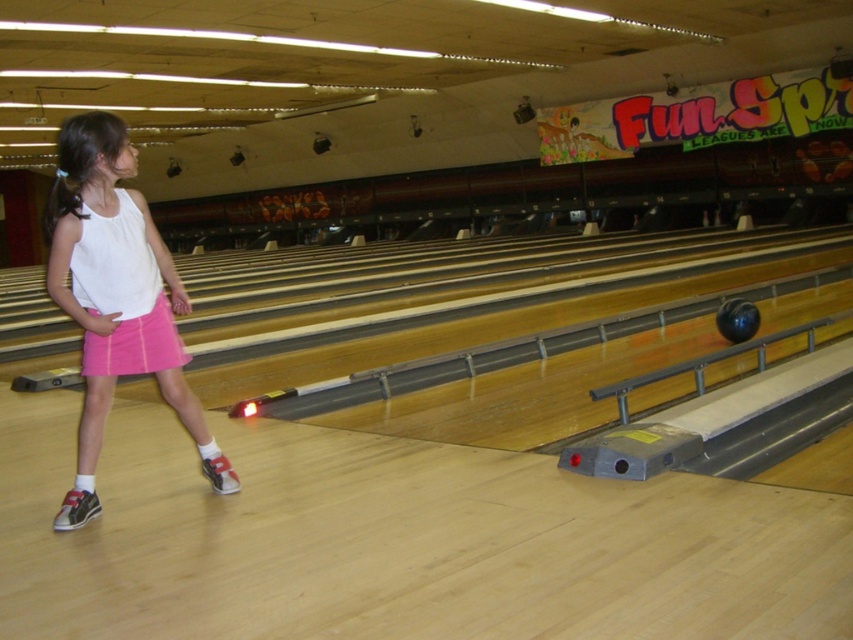
You are standing at the entrance of the bowling alley and see two points marked on the lane. Which point, point (x=85, y=129) or point (x=137, y=348), is closer to you?

Point (x=85, y=129) is closer to the viewer than point (x=137, y=348).

You are standing at the entrance of the bowling alley and see a point marked at coordinates (78, 282). If you want to throw a ball that travels exactly 3.22 meters, can you reach that point with your throw?

Yes, because the point at coordinates (78, 282) is exactly 3.22 meters away from where you are standing, so if you throw the ball that distance, it will reach the point.

You are a photographer setting up a shoot in the bowling alley. You need to position a camera on a tripod so that both the white matte tank top at center and the pink cotton shorts at lower left are visible in the frame. Based on their positions, which object should be placed closer to the camera to ensure both are in focus?

The white matte tank top at center is taller than the pink cotton shorts at lower left, so to ensure both are in focus, the pink cotton shorts at lower left should be placed closer to the camera since shorter objects require less depth of field adjustment.